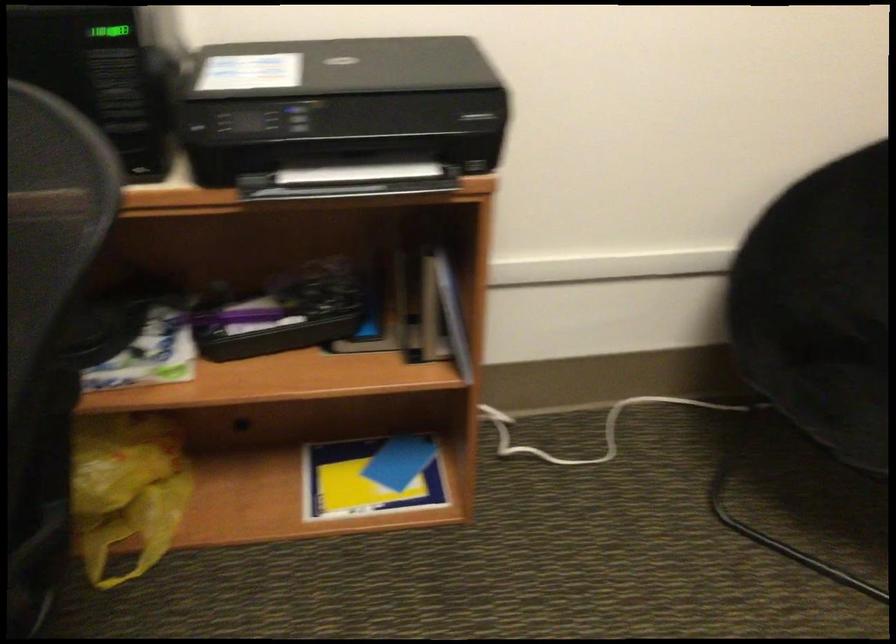
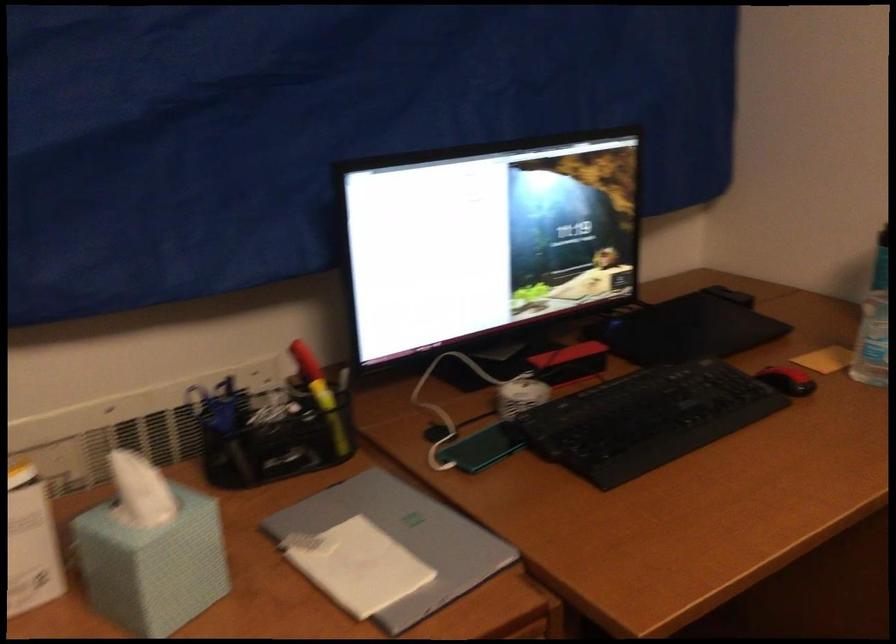
Question: How did the camera likely rotate?

Choices:
 (A) Left
 (B) Right
 (C) Up
 (D) Down

Answer: (A)